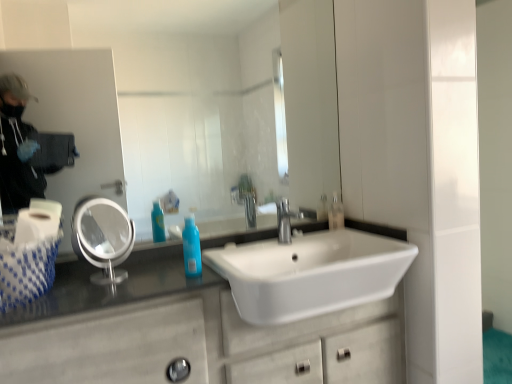
Question: From the image's perspective, is clear plastic mirror at left, the second mirror in the right-to-left sequence, beneath white marble bathroom cabinet at lower left?

Choices:
 (A) yes
 (B) no

Answer: (B)

Question: Is clear plastic mirror at left, the second mirror in the right-to-left sequence, bigger than white marble bathroom cabinet at lower left?

Choices:
 (A) yes
 (B) no

Answer: (B)

Question: Is white marble bathroom cabinet at lower left a part of clear plastic mirror at left, the first mirror from the left?

Choices:
 (A) no
 (B) yes

Answer: (A)

Question: Is clear plastic mirror at left, the first mirror from the left, not inside white marble bathroom cabinet at lower left?

Choices:
 (A) no
 (B) yes

Answer: (B)

Question: From a real-world perspective, is clear plastic mirror at left, the second mirror in the right-to-left sequence, located beneath white marble bathroom cabinet at lower left?

Choices:
 (A) no
 (B) yes

Answer: (A)

Question: From the image's perspective, would you say clear plastic mirror at left, the first mirror from the left, is positioned over white marble bathroom cabinet at lower left?

Choices:
 (A) no
 (B) yes

Answer: (B)

Question: Is white woven tissue at left facing away from white glossy sink at center?

Choices:
 (A) no
 (B) yes

Answer: (A)

Question: Does white woven tissue at left have a greater height compared to white glossy sink at center?

Choices:
 (A) yes
 (B) no

Answer: (B)

Question: Is the depth of white woven tissue at left less than that of white glossy sink at center?

Choices:
 (A) yes
 (B) no

Answer: (B)

Question: Considering the relative sizes of white woven tissue at left and white glossy sink at center in the image provided, is white woven tissue at left thinner than white glossy sink at center?

Choices:
 (A) no
 (B) yes

Answer: (B)

Question: Considering the relative positions of white woven tissue at left and white glossy sink at center in the image provided, is white woven tissue at left behind white glossy sink at center?

Choices:
 (A) yes
 (B) no

Answer: (A)

Question: Does white woven tissue at left have a lesser height compared to white glossy sink at center?

Choices:
 (A) no
 (B) yes

Answer: (B)

Question: Does blue glossy bottle at center have a greater width compared to white woven tissue at left?

Choices:
 (A) yes
 (B) no

Answer: (B)